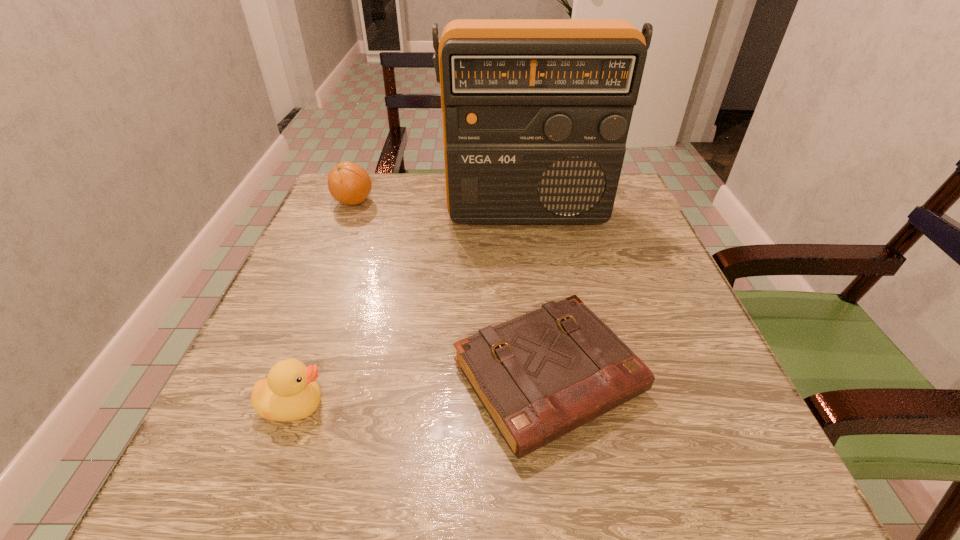
Find the location of a particular element. The width and height of the screenshot is (960, 540). the tallest object is located at coordinates (535, 112).

The width and height of the screenshot is (960, 540). In order to click on orange in this screenshot , I will do 348,183.

Where is `duck`? Image resolution: width=960 pixels, height=540 pixels. duck is located at coordinates (290, 392).

What are the coordinates of `hardback book` in the screenshot? It's located at (541, 375).

You are a GUI agent. You are given a task and a screenshot of the screen. Output one action in this format:
    pyautogui.click(x=<x>, y=<y>)
    Task: Click on the free space located on the front-facing side of the tallest object
    
    Given the screenshot: What is the action you would take?
    pyautogui.click(x=544, y=342)

This screenshot has width=960, height=540. In order to click on vacant space located 0.350m on the front of the orange in this screenshot , I will do `click(306, 318)`.

I want to click on vacant region located at the beak of the duck, so click(x=487, y=406).

Image resolution: width=960 pixels, height=540 pixels. I want to click on free location located 0.090m on the right of the shortest object, so [x=699, y=377].

The image size is (960, 540). Find the location of `radio receiver located in the far edge section of the desktop`. radio receiver located in the far edge section of the desktop is located at coordinates (535, 112).

The height and width of the screenshot is (540, 960). In order to click on orange located in the far edge section of the desktop in this screenshot , I will do tap(348, 183).